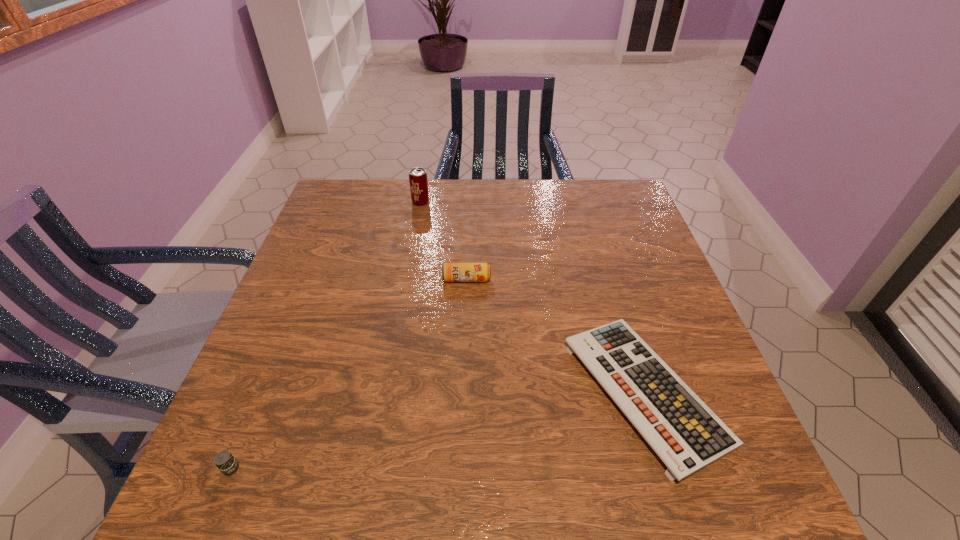
Where is `the second object from left to right`? The width and height of the screenshot is (960, 540). the second object from left to right is located at coordinates (418, 181).

You are a GUI agent. You are given a task and a screenshot of the screen. Output one action in this format:
    pyautogui.click(x=<x>, y=<y>)
    Task: Click on the farthest object
    The width and height of the screenshot is (960, 540).
    Given the screenshot: What is the action you would take?
    pyautogui.click(x=418, y=181)

Where is `the second object from right to left`? Image resolution: width=960 pixels, height=540 pixels. the second object from right to left is located at coordinates (451, 272).

Find the location of `the rightmost beer can`. the rightmost beer can is located at coordinates (451, 272).

This screenshot has width=960, height=540. I want to click on the leftmost beer can, so click(x=227, y=464).

This screenshot has width=960, height=540. Identify the location of the leftmost object. (227, 464).

Find the location of `computer keyboard`. computer keyboard is located at coordinates (685, 433).

Find the location of a particular element. The height and width of the screenshot is (540, 960). the shortest object is located at coordinates (685, 433).

This screenshot has height=540, width=960. What are the coordinates of `vacant area located 0.390m on the right of the second object from left to right` in the screenshot? It's located at (556, 202).

At what (x,y) coordinates should I click in order to perform the action: click on vacant space situated on the front of the rightmost beer can. Please return your answer as a coordinate pair (x, y). Image resolution: width=960 pixels, height=540 pixels. Looking at the image, I should click on (465, 336).